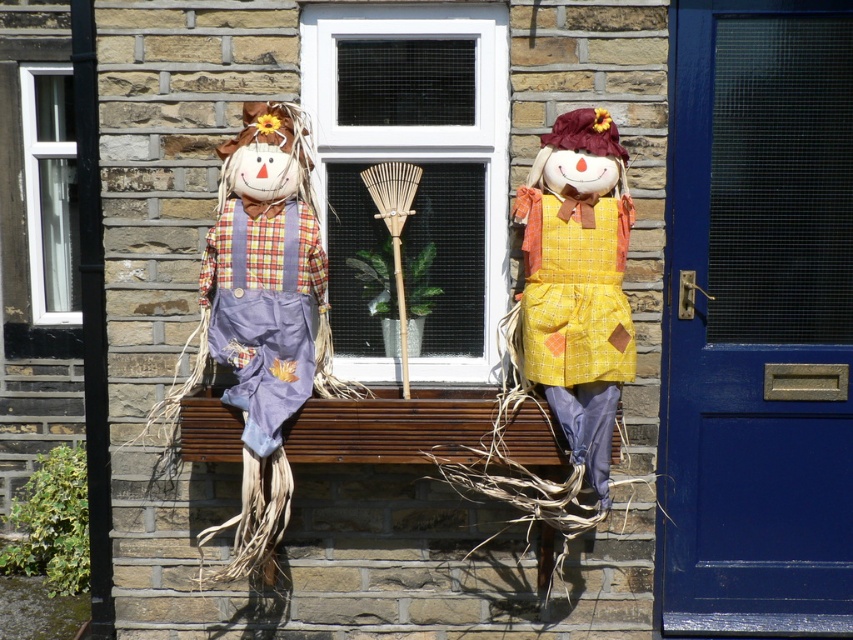
You are an artist planning to paint the two scarecrows on the bench. You notice the matte purple overalls at left and the yellow fabric doll at center. Which object is located directly above the other?

The yellow fabric doll at center is directly above the matte purple overalls at left because the matte purple overalls at left is positioned under the yellow fabric doll at center.

You are a bird flying towards the two scarecrows on the wooden bench. Which object would you reach first as you approach them? The matte purple overalls at left or the yellow fabric doll at center?

The matte purple overalls at left would be reached first because it is closer to the viewer than the yellow fabric doll at center.

You are an artist planning to paint the scene of two scarecrows on a bench near a stone wall. You need to decide which object to paint first based on their size. Which should you start with, the matte purple overalls at left or the white plastic window at left?

The matte purple overalls at left is larger in size than the white plastic window at left, so you should start with the matte purple overalls at left as it requires more attention due to its larger size.